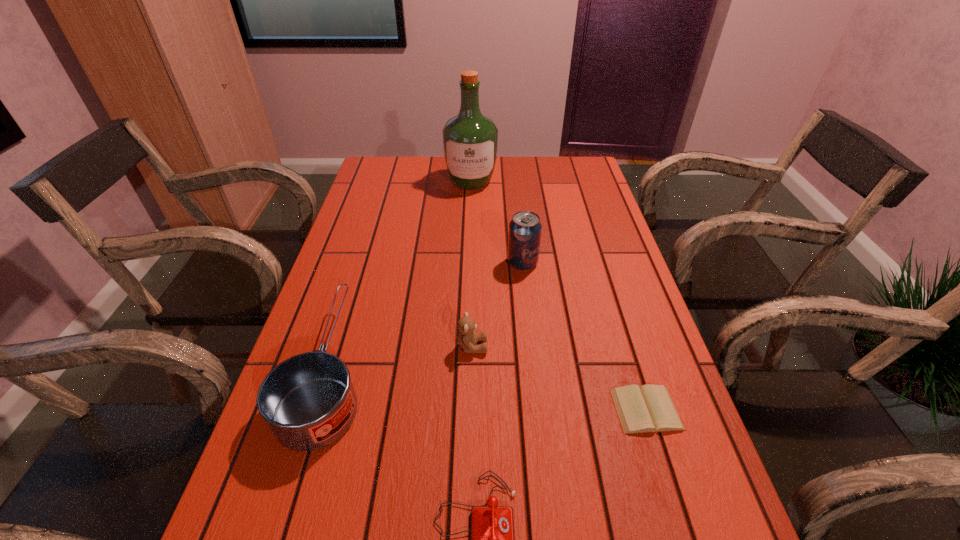
The image size is (960, 540). Identify the location of liquor. (470, 140).

Image resolution: width=960 pixels, height=540 pixels. What are the coordinates of `the farthest object` in the screenshot? It's located at (470, 140).

The image size is (960, 540). What are the coordinates of `the second object from right to left` in the screenshot? It's located at (525, 228).

Where is `the second tallest object`? the second tallest object is located at coordinates (525, 228).

Locate an element on the screen. This screenshot has height=540, width=960. saucepan is located at coordinates (308, 401).

Where is `teddy bear`? The image size is (960, 540). teddy bear is located at coordinates (467, 339).

Identify the location of diary. (649, 408).

Where is `the rightmost object`? Image resolution: width=960 pixels, height=540 pixels. the rightmost object is located at coordinates (649, 408).

Where is `vacant region located 0.370m on the front-facing side of the tallest object`? vacant region located 0.370m on the front-facing side of the tallest object is located at coordinates [x=468, y=268].

In order to click on free region located on the back of the second farthest object in this screenshot , I will do `click(517, 213)`.